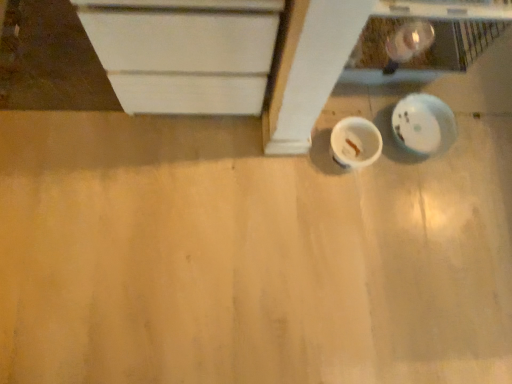
This screenshot has width=512, height=384. Identify the location of vacant space underneath white glossy plate at lower right (from a real-world perspective). (420, 134).